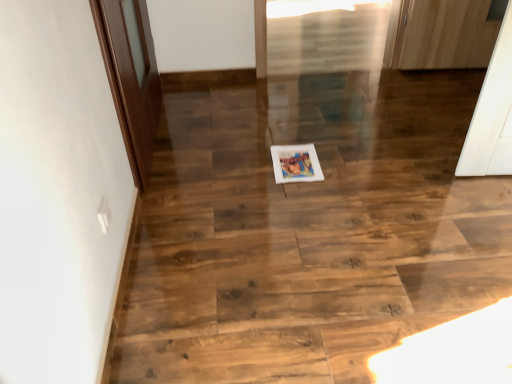
Identify the location of vacant space behind brown wooden door at left. This screenshot has height=384, width=512. (203, 96).